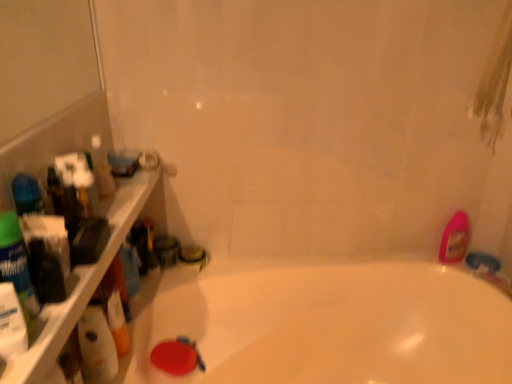
Describe the element at coordinates (328, 325) in the screenshot. The width and height of the screenshot is (512, 384). I see `white glossy bathtub at center` at that location.

Image resolution: width=512 pixels, height=384 pixels. Describe the element at coordinates (97, 345) in the screenshot. I see `white glossy bottle at left` at that location.

In order to face translucent plastic bottles at left, should I rotate leftwards or rightwards?

It's best to rotate left around 20.304 degrees.

Locate an element on the screen. This screenshot has height=384, width=512. white glossy bathtub at center is located at coordinates (328, 325).

Is white glossy bathtub at center far away from white glossy bottle at left?

Actually, white glossy bathtub at center and white glossy bottle at left are a little close together.

Which of these two, white glossy bathtub at center or white glossy bottle at left, stands shorter?

white glossy bottle at left.

From a real-world perspective, does white glossy bathtub at center sit lower than white glossy bottle at left?

Yes, from a real-world perspective, white glossy bathtub at center is beneath white glossy bottle at left.

Is white glossy bathtub at center at the right side of white glossy bottle at left?

Yes, white glossy bathtub at center is to the right of white glossy bottle at left.

From a real-world perspective, who is located lower, translucent plastic bottles at left or white glossy bathtub at center?

In real-world perspective, white glossy bathtub at center is lower.

Which is in front, translucent plastic bottles at left or white glossy bathtub at center?

translucent plastic bottles at left is in front.

From the image's perspective, is translucent plastic bottles at left under white glossy bathtub at center?

No, from the image's perspective, translucent plastic bottles at left is not beneath white glossy bathtub at center.

Does translucent plastic bottles at left turn towards white glossy bathtub at center?

No.

Considering their positions, is pink glossy bottle at right located in front of or behind translucent plastic bottles at left?

Visually, pink glossy bottle at right is located behind translucent plastic bottles at left.

Is pink glossy bottle at right oriented towards translucent plastic bottles at left?

No.

Can you confirm if pink glossy bottle at right is positioned to the right of translucent plastic bottles at left?

Indeed, pink glossy bottle at right is positioned on the right side of translucent plastic bottles at left.

What's the angular difference between translucent plastic bottles at left and pink glossy bottle at right's facing directions?

90.4 degrees.

Considering the relative positions of translucent plastic bottles at left and pink glossy bottle at right in the image provided, is translucent plastic bottles at left to the left or to the right of pink glossy bottle at right?

translucent plastic bottles at left is positioned on pink glossy bottle at right's left side.

Considering the sizes of translucent plastic bottles at left and pink glossy bottle at right in the image, is translucent plastic bottles at left wider or thinner than pink glossy bottle at right?

Clearly, translucent plastic bottles at left has more width compared to pink glossy bottle at right.

From a real-world perspective, is pink glossy bottle at right positioned over white glossy bottle at left based on gravity?

No, from a real-world perspective, pink glossy bottle at right is not above white glossy bottle at left.

How different are the orientations of pink glossy bottle at right and white glossy bottle at left in degrees?

90 degrees.

Considering the sizes of objects pink glossy bottle at right and white glossy bottle at left in the image provided, who is smaller, pink glossy bottle at right or white glossy bottle at left?

With smaller size is pink glossy bottle at right.

Does pink glossy bottle at right have a greater width compared to white glossy bottle at left?

No.

Considering the sizes of objects white glossy bottle at left and translucent plastic bottles at left in the image provided, who is wider, white glossy bottle at left or translucent plastic bottles at left?

translucent plastic bottles at left.

Is white glossy bottle at left directly adjacent to translucent plastic bottles at left?

No, white glossy bottle at left is not in contact with translucent plastic bottles at left.

Which is behind, white glossy bottle at left or translucent plastic bottles at left?

white glossy bottle at left is behind.

Is white glossy bottle at left inside the boundaries of translucent plastic bottles at left, or outside?

white glossy bottle at left is spatially situated outside translucent plastic bottles at left.

Who is shorter, white glossy bottle at left or white glossy bathtub at center?

With less height is white glossy bottle at left.

Between white glossy bottle at left and white glossy bathtub at center, which one appears on the left side from the viewer's perspective?

white glossy bottle at left is more to the left.

From a real-world perspective, is white glossy bottle at left on top of white glossy bathtub at center?

Indeed, from a real-world perspective, white glossy bottle at left stands above white glossy bathtub at center.

In the image, there is a white glossy bathtub at center. Identify the location of cleaning product above it (from the image's perspective). The width and height of the screenshot is (512, 384). (97, 345).

The height and width of the screenshot is (384, 512). What are the coordinates of `bathtub located underneath the translucent plastic bottles at left (from a real-world perspective)` in the screenshot? It's located at (x=328, y=325).

From the image, which object appears to be nearer to white glossy bottle at left, pink glossy bottle at right or translucent plastic bottles at left?

Among the two, translucent plastic bottles at left is located nearer to white glossy bottle at left.

Which object lies further to the anchor point translucent plastic bottles at left, white glossy bathtub at center or pink glossy bottle at right?

Among the two, pink glossy bottle at right is located further to translucent plastic bottles at left.

Estimate the real-world distances between objects in this image. Which object is further from white glossy bathtub at center, pink glossy bottle at right or white glossy bottle at left?

Among the two, white glossy bottle at left is located further to white glossy bathtub at center.

When comparing their distances from white glossy bottle at left, does white glossy bathtub at center or pink glossy bottle at right seem further?

Based on the image, pink glossy bottle at right appears to be further to white glossy bottle at left.

From the image, which object appears to be farther from translucent plastic bottles at left, white glossy bottle at left or pink glossy bottle at right?

pink glossy bottle at right is positioned further to the anchor translucent plastic bottles at left.

When comparing their distances from white glossy bathtub at center, does translucent plastic bottles at left or white glossy bottle at left seem further?

Based on the image, translucent plastic bottles at left appears to be further to white glossy bathtub at center.

Looking at the image, which one is located closer to pink glossy bottle at right, white glossy bottle at left or translucent plastic bottles at left?

translucent plastic bottles at left is positioned closer to the anchor pink glossy bottle at right.

Looking at the image, which one is located closer to white glossy bottle at left, translucent plastic bottles at left or pink glossy bottle at right?

translucent plastic bottles at left.

At what (x,y) coordinates should I click in order to perform the action: click on cleaning product between translucent plastic bottles at left and pink glossy bottle at right from left to right. Please return your answer as a coordinate pair (x, y). The height and width of the screenshot is (384, 512). Looking at the image, I should click on (97, 345).

Image resolution: width=512 pixels, height=384 pixels. What are the coordinates of `bathtub located between white glossy bottle at left and pink glossy bottle at right in the left-right direction` in the screenshot? It's located at (328, 325).

The image size is (512, 384). I want to click on bathtub between translucent plastic bottles at left and pink glossy bottle at right, so click(328, 325).

Identify the location of cleaning product located between translucent plastic bottles at left and white glossy bathtub at center in the left-right direction. (97, 345).